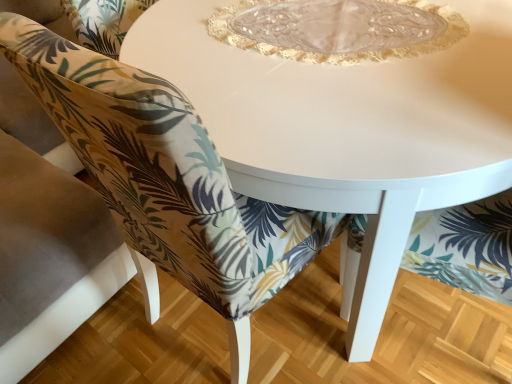
Question: From a real-world perspective, is printed fabric chair at center above or below transparent glass plate at center?

Choices:
 (A) above
 (B) below

Answer: (B)

Question: Considering the relative positions of printed fabric chair at center and transparent glass plate at center in the image provided, is printed fabric chair at center to the left or to the right of transparent glass plate at center?

Choices:
 (A) right
 (B) left

Answer: (B)

Question: Which object is positioned closest to the transparent glass plate at center?

Choices:
 (A) printed fabric chair at center
 (B) white glossy table at center

Answer: (B)

Question: Which of these objects is positioned closest to the printed fabric chair at center?

Choices:
 (A) white glossy table at center
 (B) transparent glass plate at center

Answer: (A)